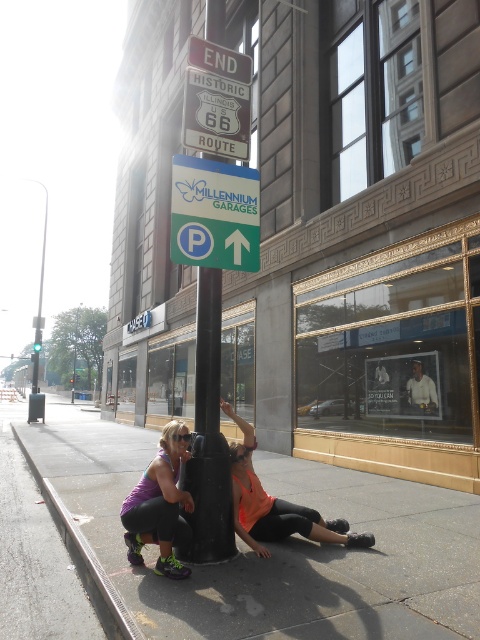
You are a delivery person who needs to park your 2.5 meter wide delivery van. You see the green plastic parking sign at center and the gray concrete curb at lower left. Which parking space can accommodate your van?

The gray concrete curb at lower left has a greater width than the green plastic parking sign at center, so the gray concrete curb at lower left can accommodate the 2.5 meter wide delivery van.

Looking at this image, you are a delivery driver who needs to park your vehicle near the gray concrete curb at lower left. However, there is a green plastic parking sign at center in the way. Is the sign blocking the entrance to the parking space?

Result: The green plastic parking sign at center is located above the gray concrete curb at lower left, so it is positioned in a way that might block the entrance to the parking space.

You are a delivery person trying to park your van in the Millennium Garages. You see the green plastic parking sign at center and the purple fabric tank top at lower left. Which object is higher up from the ground?

The green plastic parking sign at center is located above the purple fabric tank top at lower left, so the green plastic parking sign at center is higher up from the ground.